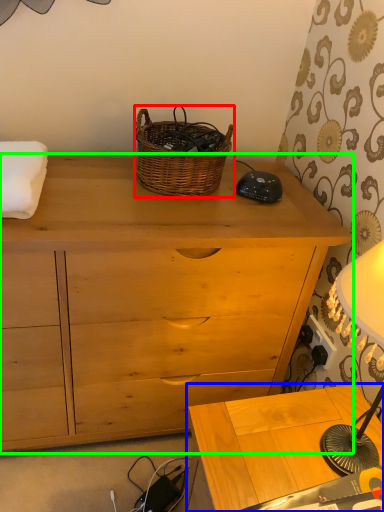
Question: Which is farther away from picnic basket (highlighted by a red box)? table (highlighted by a blue box) or chest of drawers (highlighted by a green box)?

Choices:
 (A) table
 (B) chest of drawers

Answer: (A)